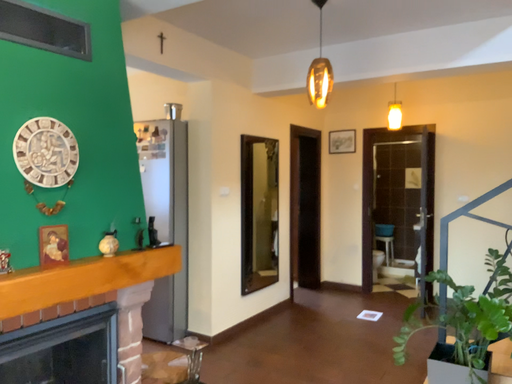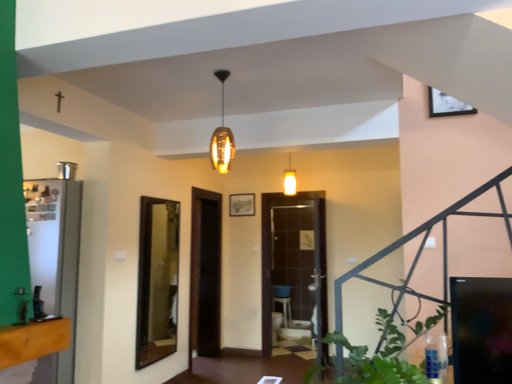
Question: How did the camera likely rotate when shooting the video?

Choices:
 (A) rotated left
 (B) rotated right

Answer: (B)